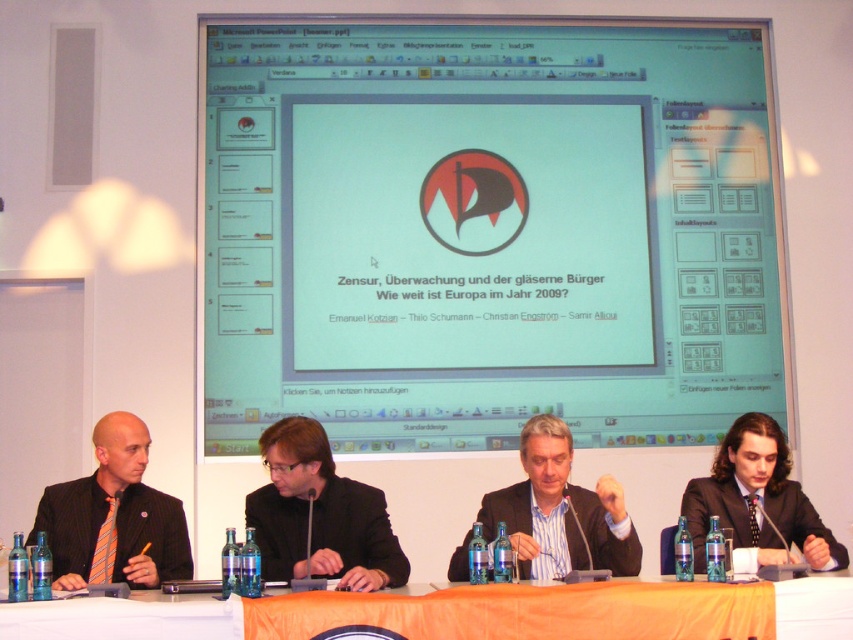
Question: Estimate the real-world distances between objects in this image. Which object is closer to the black suit at center?

Choices:
 (A) orange fabric table at lower center
 (B) light brown suit at center

Answer: (A)

Question: Which point is farther to the camera?

Choices:
 (A) (844, 593)
 (B) (788, 525)
 (C) (471, 260)

Answer: (C)

Question: Among these objects, which one is farthest from the camera?

Choices:
 (A) dark brown suit at right
 (B) black suit at center
 (C) white glossy screen at upper center
 (D) orange fabric table at lower center

Answer: (C)

Question: Can you confirm if white glossy screen at upper center is positioned below orange fabric table at lower center?

Choices:
 (A) no
 (B) yes

Answer: (A)

Question: Is the position of black suit at center less distant than that of orange striped tie at left?

Choices:
 (A) no
 (B) yes

Answer: (B)

Question: Does white glossy screen at upper center appear on the right side of orange fabric table at lower center?

Choices:
 (A) yes
 (B) no

Answer: (B)